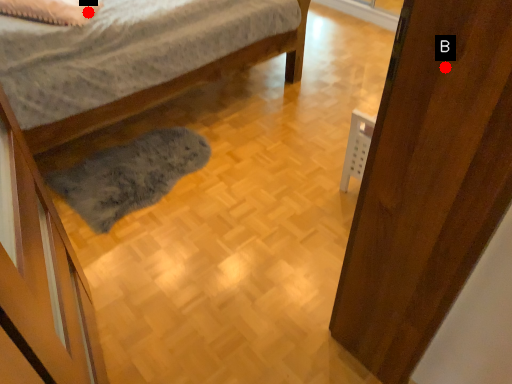
Question: Two points are circled on the image, labeled by A and B beside each circle. Which point is closer to the camera?

Choices:
 (A) A is closer
 (B) B is closer

Answer: (B)